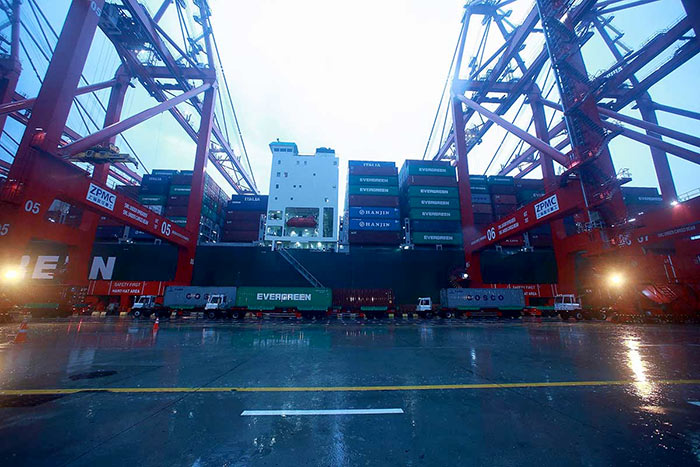
Locate an element on the screen. Image resolution: width=700 pixels, height=467 pixels. floor is located at coordinates (383, 376).